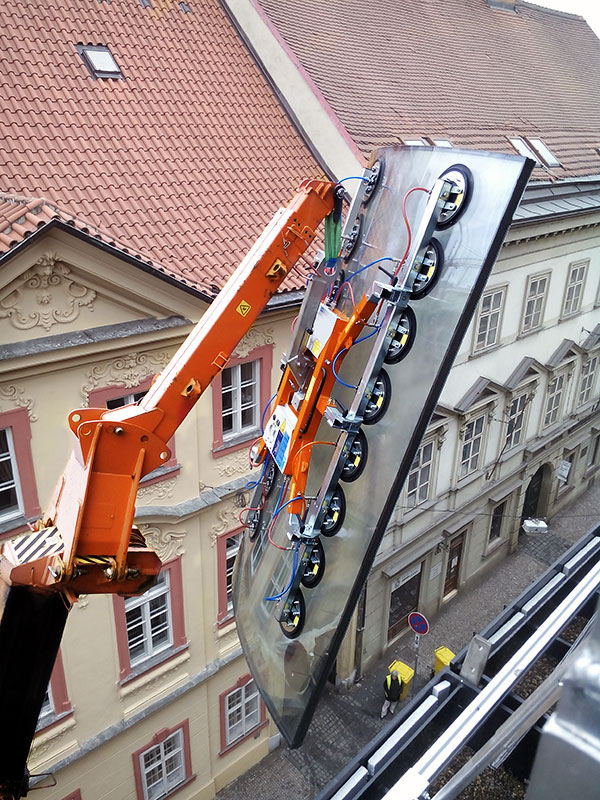
Identify the location of entry way. This screenshot has width=600, height=800. (529, 504).